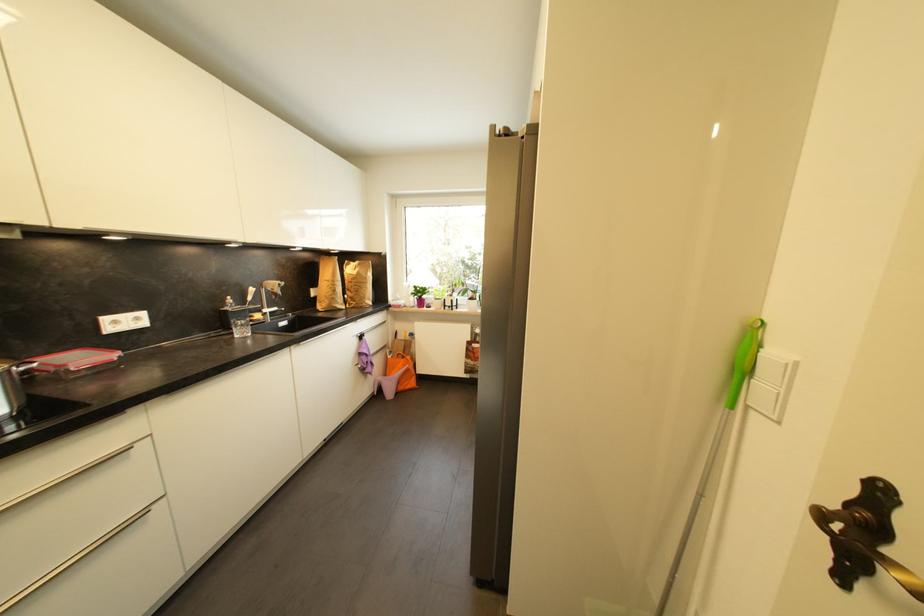
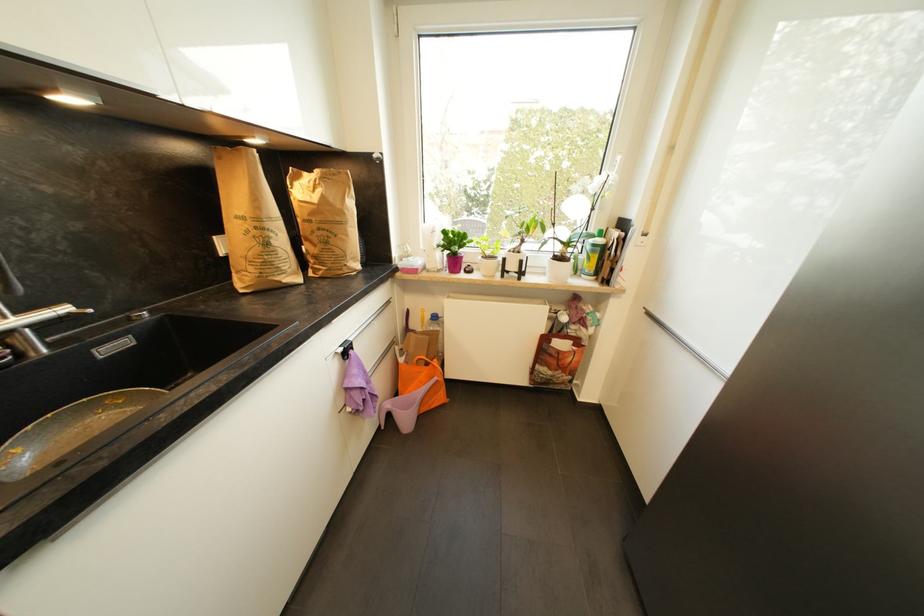
The point at (339,293) is marked in the first image. Where is the corresponding point in the second image?

(272, 246)